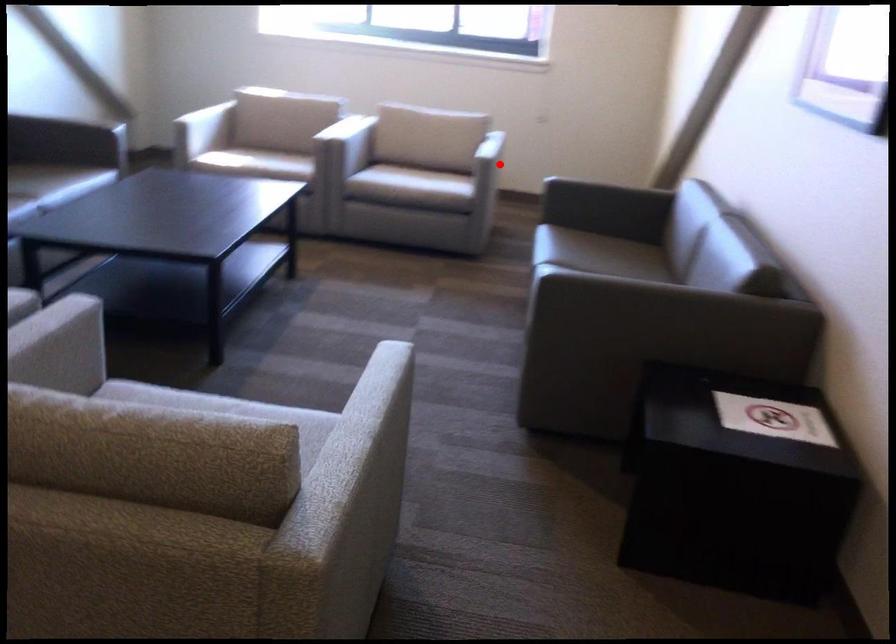
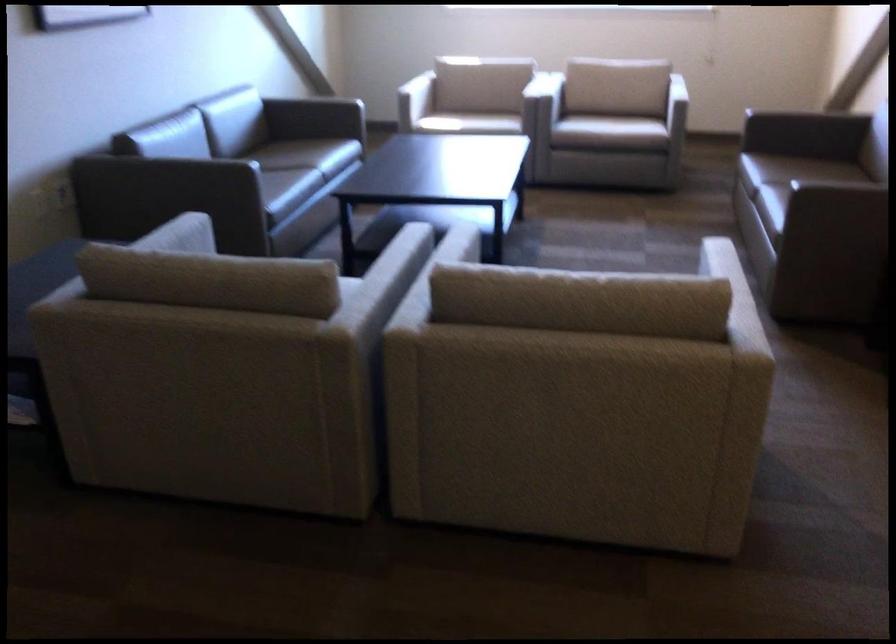
Question: I am providing you with two images of the same scene from different viewpoints. A red point is marked on the first image. Can you still see the location of the red point in image 2?

Choices:
 (A) Yes
 (B) No

Answer: (B)